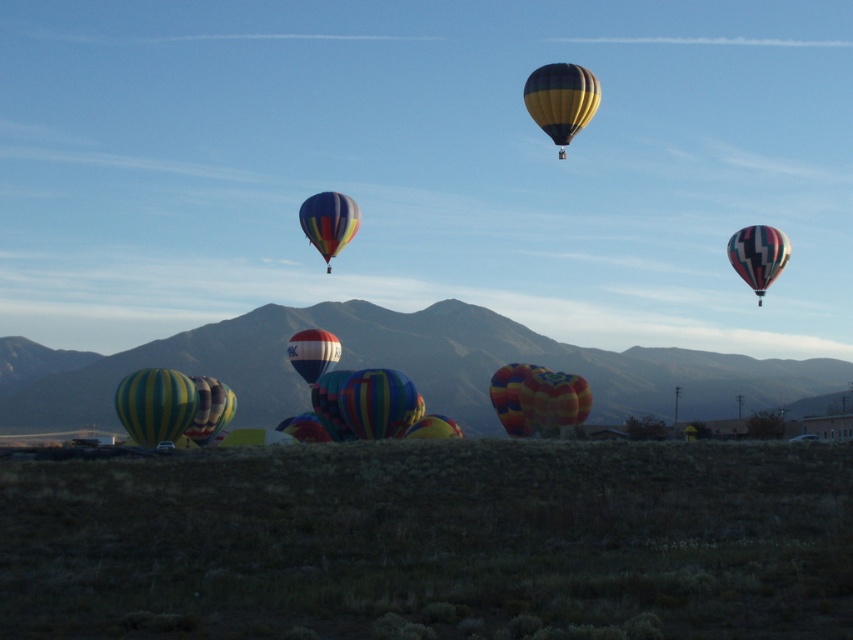
You are a photographer positioned at the origin point of the image coordinate system. You want to capture the multicolored fabric balloon at upper center in your shot. What are the coordinates of this balloon?

The coordinates of the multicolored fabric balloon at upper center are at point [329,221].

Looking at this image, you are a photographer standing in the field and want to capture both the multicolored fabric balloon at center and the multicolored fabric hot air balloon at center in a single shot. Given that your camera has a maximum focus range of 10 feet, will you be able to include both in the frame?

The multicolored fabric balloon at center is 8.74 feet away from the multicolored fabric hot air balloon at center. Since the distance between them is within the camera maximum focus range of 10 feet, you can include both in the frame.

You are standing at the origin point of the coordinate system in the image. You want to walk towards the multicolored fabric balloon at center. Which direction should you head? Please provide your answer in terms of the coordinate system provided.

To reach the multicolored fabric balloon at center located at coordinate point [554,400], you should move in the positive x and positive y direction from the origin point.